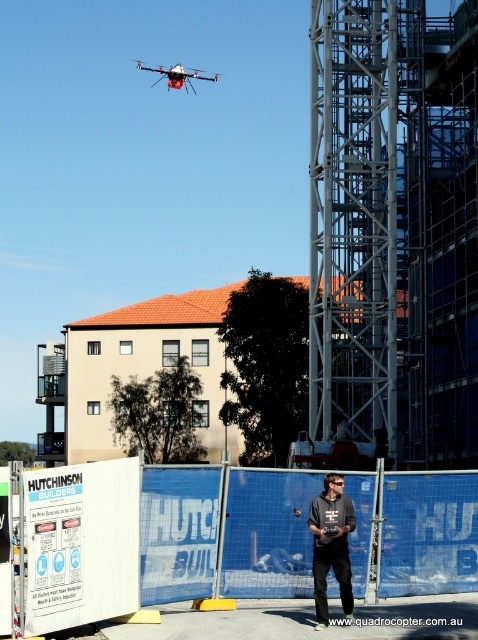
Question: Is dark gray shirt at center thinner than white matte drone at upper center?

Choices:
 (A) yes
 (B) no

Answer: (A)

Question: Is dark gray shirt at center bigger than white matte drone at upper center?

Choices:
 (A) no
 (B) yes

Answer: (A)

Question: Does dark gray shirt at center appear over white matte drone at upper center?

Choices:
 (A) yes
 (B) no

Answer: (B)